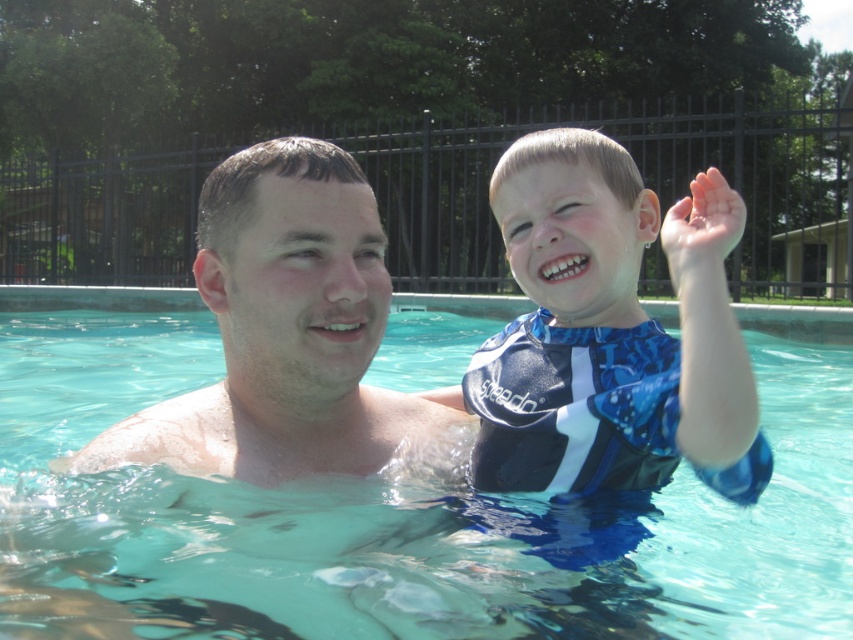
Does blue/white textured life vest at center have a lesser width compared to transparent plastic hand at upper right?

Indeed, blue/white textured life vest at center has a lesser width compared to transparent plastic hand at upper right.

Describe the element at coordinates (610, 332) in the screenshot. I see `blue/white textured life vest at center` at that location.

Which is in front, point (492, 177) or point (689, 243)?

Point (689, 243) is in front.

Identify the location of blue/white textured life vest at center. (610, 332).

In the scene shown: Who is higher up, blue/white textured life vest at center or smooth skin man at center?

Positioned higher is blue/white textured life vest at center.

From the picture: Between blue/white textured life vest at center and smooth skin man at center, which one appears on the right side from the viewer's perspective?

Positioned to the right is blue/white textured life vest at center.

What do you see at coordinates (610, 332) in the screenshot? I see `blue/white textured life vest at center` at bounding box center [610, 332].

Find the location of a particular element. blue/white textured life vest at center is located at coordinates (610, 332).

In the scene shown: Does clear blue water at upper center appear under transparent plastic hand at upper right?

Yes, clear blue water at upper center is below transparent plastic hand at upper right.

Between clear blue water at upper center and transparent plastic hand at upper right, which one has less height?

Standing shorter between the two is transparent plastic hand at upper right.

Is point (254, 552) closer to camera compared to point (708, 220)?

Yes.

This screenshot has height=640, width=853. I want to click on clear blue water at upper center, so (x=374, y=513).